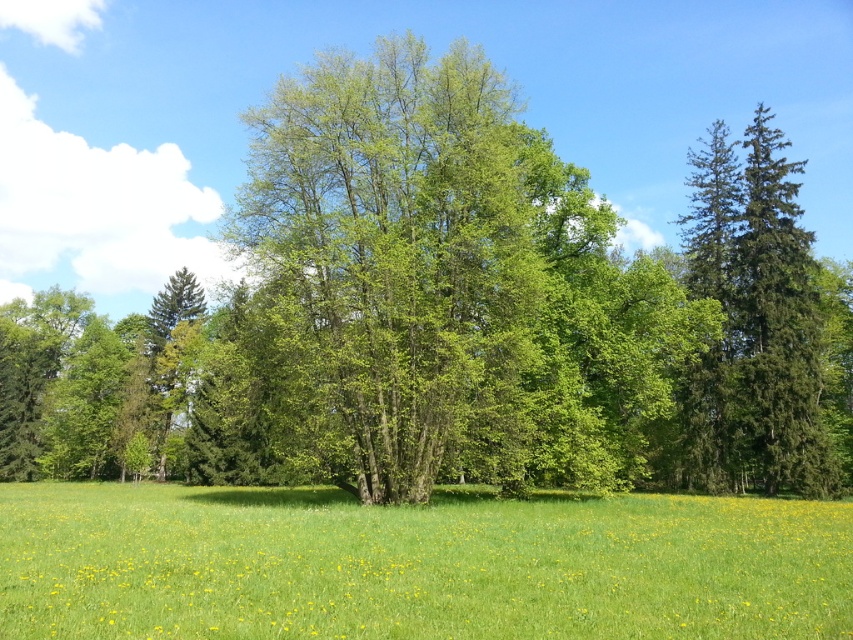
You are a landscape architect designing a walking path between the green leafy tree at center and the green grassy pasture at center. What is the minimum width the path needs to be to ensure a 2 meter buffer on both sides of the path?

The path must be at least 18.76 meters wide to accommodate the 2 meter buffer on both sides of the green leafy tree at center and green grassy pasture at center, which are 14.76 meters apart.

You are standing in the middle of the green grassy pasture at center and want to reach the green leafy tree at center. Which direction should you move to get closer to the tree?

Since the green leafy tree at center is further to the viewer than the green grassy pasture at center, you are already standing closer to the tree. To reach it, move forward towards where the tree appears in the distance.

You are a gardener planning to plant a new tree in the green grassy pasture at center. Considering the current layout, will the green leafy tree at center interfere with sunlight reaching the pasture below?

The green leafy tree at center is positioned over the green grassy pasture at center, so it may cast shade and reduce sunlight reaching the pasture below. This could potentially hinder the grass growth if the shade is too dense.